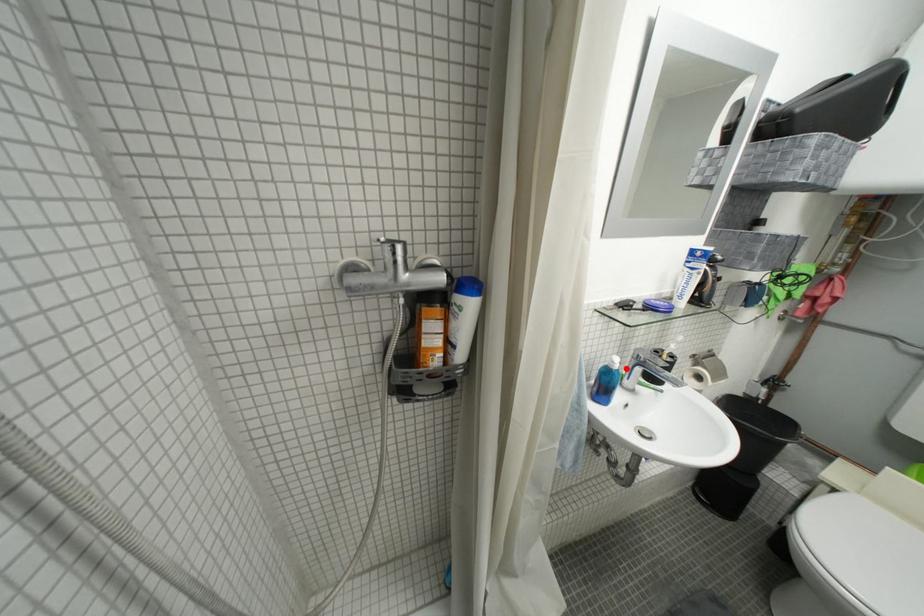
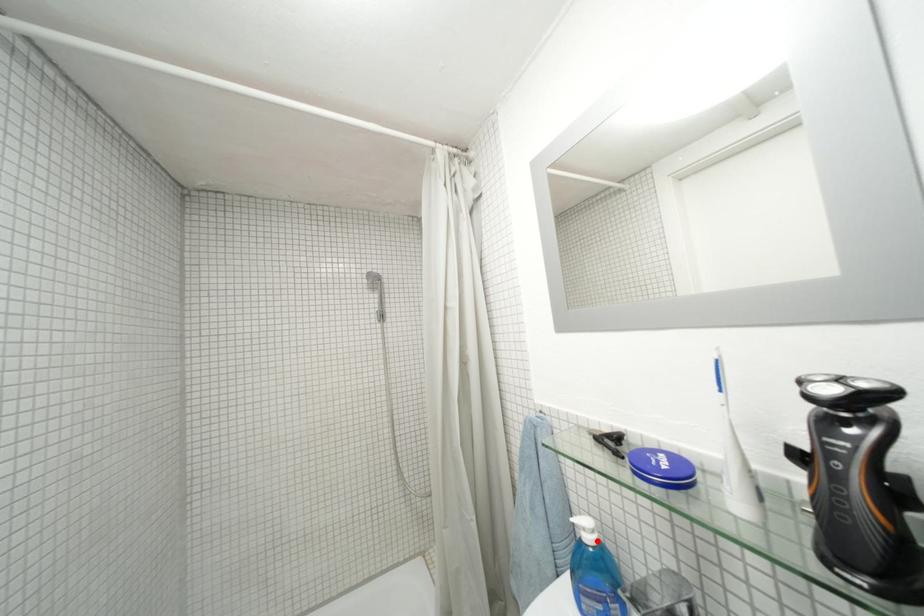
I am providing you with two images of the same scene from different viewpoints. A red point is marked on the first image and another point is marked on the second image. Do the highlighted points in image1 and image2 indicate the same real-world spot?

Yes